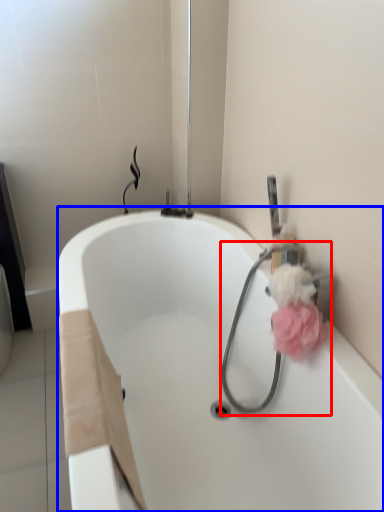
Question: Which object is closer to the camera taking this photo, garden hose (highlighted by a red box) or bathtub (highlighted by a blue box)?

Choices:
 (A) garden hose
 (B) bathtub

Answer: (B)